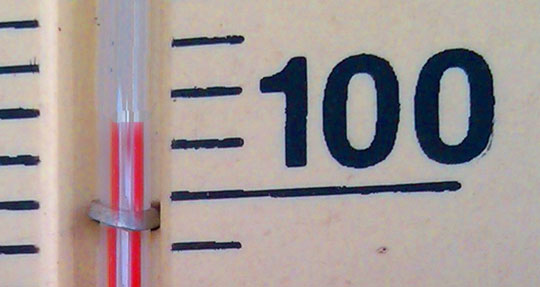
In order to click on thermometer in this screenshot , I will do 124,147.